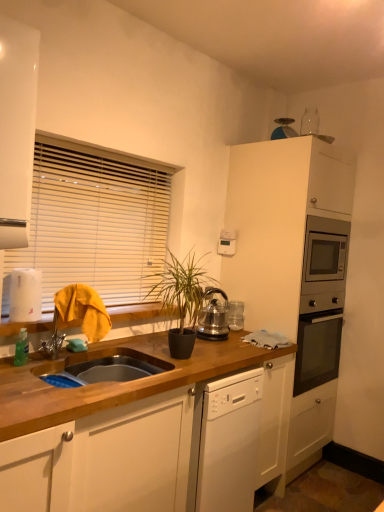
You are a GUI agent. You are given a task and a screenshot of the screen. Output one action in this format:
    pyautogui.click(x=<x>, y=<y>)
    Task: Click on the green matte plant at center
    The height and width of the screenshot is (512, 384).
    Given the screenshot: What is the action you would take?
    pyautogui.click(x=182, y=298)

Locate an element on the screen. The image size is (384, 512). polished stainless steel kettle at center is located at coordinates (213, 317).

How much space does white matte cabinet at upper right, marked as the first cabinetry in a right-to-left arrangement, occupy vertically?

The height of white matte cabinet at upper right, marked as the first cabinetry in a right-to-left arrangement, is 2.10 meters.

Locate an element on the screen. The image size is (384, 512). white glossy cabinet at upper left, arranged as the first cabinetry when viewed from the left is located at coordinates (17, 129).

How distant is green matte plant at center from polished stainless steel kettle at center?

A distance of 20.40 centimeters exists between green matte plant at center and polished stainless steel kettle at center.

From their relative heights in the image, would you say green matte plant at center is taller or shorter than polished stainless steel kettle at center?

Clearly, green matte plant at center is taller compared to polished stainless steel kettle at center.

Looking at this image, is green matte plant at center looking in the opposite direction of polished stainless steel kettle at center?

green matte plant at center does not have its back to polished stainless steel kettle at center.

Can you see green matte plant at center touching polished stainless steel kettle at center?

No, green matte plant at center is not next to polished stainless steel kettle at center.

Considering the sizes of objects wooden blinds at upper left and green matte plant at center in the image provided, who is wider, wooden blinds at upper left or green matte plant at center?

green matte plant at center is wider.

Between point (86, 187) and point (173, 273), which one is positioned in front?

The point (173, 273) is more forward.

Can you confirm if wooden blinds at upper left is smaller than green matte plant at center?

No.

Is wooden blinds at upper left shorter than green matte plant at center?

No, wooden blinds at upper left is not shorter than green matte plant at center.

Which of these two, white matte cabinet at upper right, marked as the first cabinetry in a right-to-left arrangement, or white glossy cabinet at upper left, placed as the second cabinetry when sorted from right to left, stands taller?

Standing taller between the two is white matte cabinet at upper right, marked as the first cabinetry in a right-to-left arrangement.

Is white matte cabinet at upper right, the 1th cabinetry viewed from the back, looking in the opposite direction of white glossy cabinet at upper left, marked as the first cabinetry in a front-to-back arrangement?

No.

Which of these two, white matte cabinet at upper right, marked as the first cabinetry in a right-to-left arrangement, or white glossy cabinet at upper left, arranged as the first cabinetry when viewed from the left, is thinner?

white glossy cabinet at upper left, arranged as the first cabinetry when viewed from the left.

Does white matte cabinet at upper right, which is the 2th cabinetry in left-to-right order, have a smaller size compared to white glossy cabinet at upper left, acting as the second cabinetry starting from the back?

No, white matte cabinet at upper right, which is the 2th cabinetry in left-to-right order, is not smaller than white glossy cabinet at upper left, acting as the second cabinetry starting from the back.

How different are the orientations of wooden at left and wooden blinds at upper left in degrees?

0.0106 degrees separate the facing orientations of wooden at left and wooden blinds at upper left.

Between wooden at left and wooden blinds at upper left, which one has less height?

With less height is wooden blinds at upper left.

Which is more to the left, wooden at left or wooden blinds at upper left?

wooden blinds at upper left is more to the left.

Would you say green matte plant at center is to the left or to the right of wooden blinds at upper left in the picture?

Based on their positions, green matte plant at center is located to the right of wooden blinds at upper left.

Considering the positions of points (186, 328) and (62, 251), is point (186, 328) closer to camera compared to point (62, 251)?

That is True.

Does green matte plant at center have a smaller size compared to wooden blinds at upper left?

Correct, green matte plant at center occupies less space than wooden blinds at upper left.

Between polished stainless steel kettle at center and wooden at left, which one has less height?

Standing shorter between the two is polished stainless steel kettle at center.

Is polished stainless steel kettle at center positioned before wooden at left?

No, polished stainless steel kettle at center is behind wooden at left.

Identify the location of countertop in front of the polished stainless steel kettle at center. The height and width of the screenshot is (512, 384). (109, 426).

Is white glossy cabinet at upper left, acting as the second cabinetry starting from the back, touching polished stainless steel kettle at center?

No, white glossy cabinet at upper left, acting as the second cabinetry starting from the back, is not with polished stainless steel kettle at center.

Which of these two, white glossy cabinet at upper left, acting as the second cabinetry starting from the back, or polished stainless steel kettle at center, stands taller?

white glossy cabinet at upper left, acting as the second cabinetry starting from the back, is taller.

Does point (32, 39) appear closer or farther from the camera than point (216, 318)?

Point (32, 39).

Which object is more forward, white glossy cabinet at upper left, arranged as the first cabinetry when viewed from the left, or polished stainless steel kettle at center?

white glossy cabinet at upper left, arranged as the first cabinetry when viewed from the left, is in front.

In order to click on houseplant located above the polished stainless steel kettle at center (from a real-world perspective) in this screenshot , I will do `click(182, 298)`.

Image resolution: width=384 pixels, height=512 pixels. I want to click on window blind behind the green matte plant at center, so click(94, 221).

Based on their spatial positions, is white glossy cabinet at upper left, arranged as the first cabinetry when viewed from the left, or polished stainless steel kettle at center further from wooden at left?

Based on the image, white glossy cabinet at upper left, arranged as the first cabinetry when viewed from the left, appears to be further to wooden at left.

Considering their positions, is wooden at left positioned further to white matte cabinet at upper right, which is the 2th cabinetry in left-to-right order, than polished stainless steel kettle at center?

wooden at left is positioned further to the anchor white matte cabinet at upper right, which is the 2th cabinetry in left-to-right order.

Which object lies further to the anchor point white glossy cabinet at upper left, acting as the second cabinetry starting from the back, wooden at left or polished stainless steel kettle at center?

polished stainless steel kettle at center is further to white glossy cabinet at upper left, acting as the second cabinetry starting from the back.

Consider the image. When comparing their distances from white matte cabinet at upper right, positioned as the 2th cabinetry in front-to-back order, does green matte plant at center or polished stainless steel kettle at center seem closer?

The object closer to white matte cabinet at upper right, positioned as the 2th cabinetry in front-to-back order, is polished stainless steel kettle at center.

Looking at the image, which one is located further to white matte cabinet at upper right, which is the 2th cabinetry in left-to-right order, wooden blinds at upper left or green matte plant at center?

The object further to white matte cabinet at upper right, which is the 2th cabinetry in left-to-right order, is wooden blinds at upper left.

From the image, which object appears to be farther from wooden blinds at upper left, wooden at left or polished stainless steel kettle at center?

Based on the image, wooden at left appears to be further to wooden blinds at upper left.

Considering their positions, is polished stainless steel kettle at center positioned closer to wooden blinds at upper left than green matte plant at center?

Among the two, green matte plant at center is located nearer to wooden blinds at upper left.

Based on their spatial positions, is green matte plant at center or white matte cabinet at upper right, which is the 2th cabinetry in left-to-right order, further from polished stainless steel kettle at center?

white matte cabinet at upper right, which is the 2th cabinetry in left-to-right order, is positioned further to the anchor polished stainless steel kettle at center.

Locate an element on the screen. The height and width of the screenshot is (512, 384). houseplant between wooden blinds at upper left and wooden at left in the up-down direction is located at coordinates (182, 298).

Image resolution: width=384 pixels, height=512 pixels. What are the coordinates of `houseplant positioned between white glossy cabinet at upper left, acting as the second cabinetry starting from the back, and polished stainless steel kettle at center from near to far` in the screenshot? It's located at click(x=182, y=298).

Where is `kitchen appliance located between wooden blinds at upper left and white matte cabinet at upper right, which is the 2th cabinetry in left-to-right order, in the left-right direction`? The height and width of the screenshot is (512, 384). kitchen appliance located between wooden blinds at upper left and white matte cabinet at upper right, which is the 2th cabinetry in left-to-right order, in the left-right direction is located at coordinates (213, 317).

I want to click on houseplant between wooden blinds at upper left and polished stainless steel kettle at center in the horizontal direction, so click(182, 298).